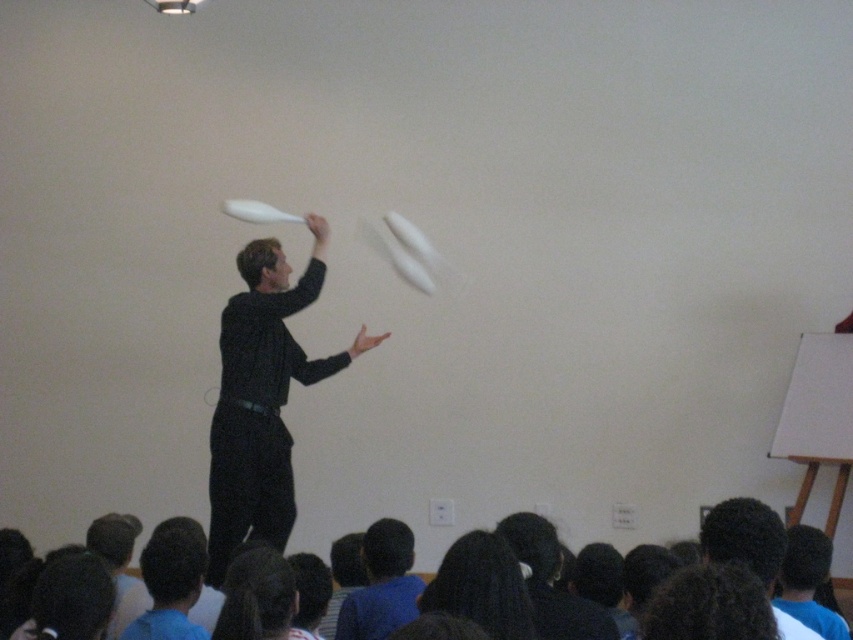
You are a photographer standing in front of the stage where the juggling act is happening. You want to capture a closeup of the dark hair at lower center. Given that your camera can focus on objects within 1.5 meters, will you need to move closer or farther away to get a clear shot?

The dark hair at lower center is 1.88 meters from the viewer. Since your camera focuses within 1.5 meters, you need to move closer to be within the focus range.

You are an audience member sitting in the front row of the juggling performance. You notice two items in the image, the black matte shirt at center and the dark hair at lower center. Which item appears larger in size?

The black matte shirt at center is bigger than the dark hair at lower center, so the black matte shirt at center appears larger in size.

You are an audience member sitting in the front row. You notice the black matte shirt at center and the dark hair at lower center in the image. Which object is wider from your perspective?

The black matte shirt at center is wider than dark hair at lower center.